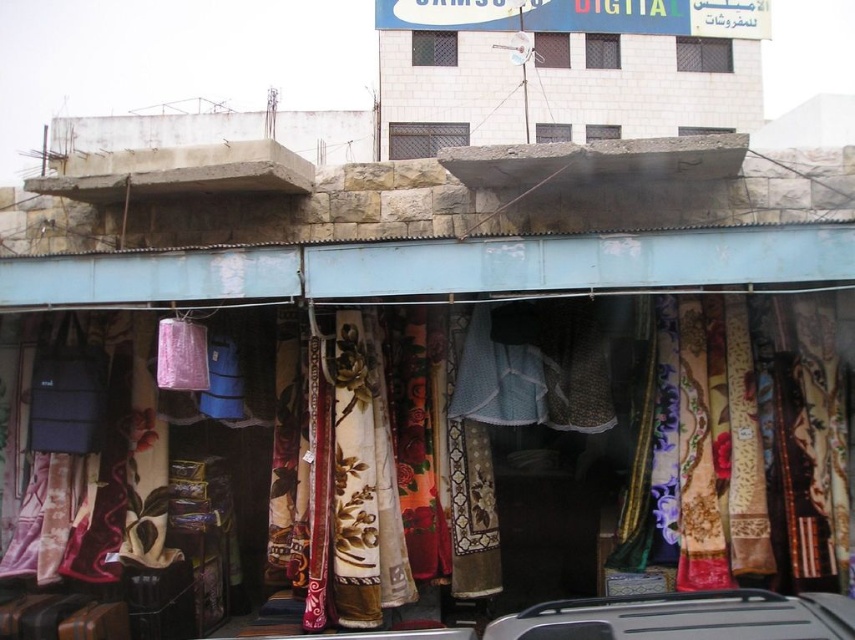
You are a customer looking to buy fabric for a small project. You see the floral fabric at center and the silver metallic car at lower center. Which object is bigger and would require more space to handle?

The floral fabric at center is larger in size than the silver metallic car at lower center, so it would require more space to handle.

You are standing in front of the store and want to take a photo of the textiles displayed outside. If you move 10 feet closer to the point at coordinates point (133, 422), will you be within 15 feet of it?

The distance of point (133, 422) from camera is 21.47 feet. Moving 10 feet closer would bring you to 11.47 feet away, which is within 15 feet.